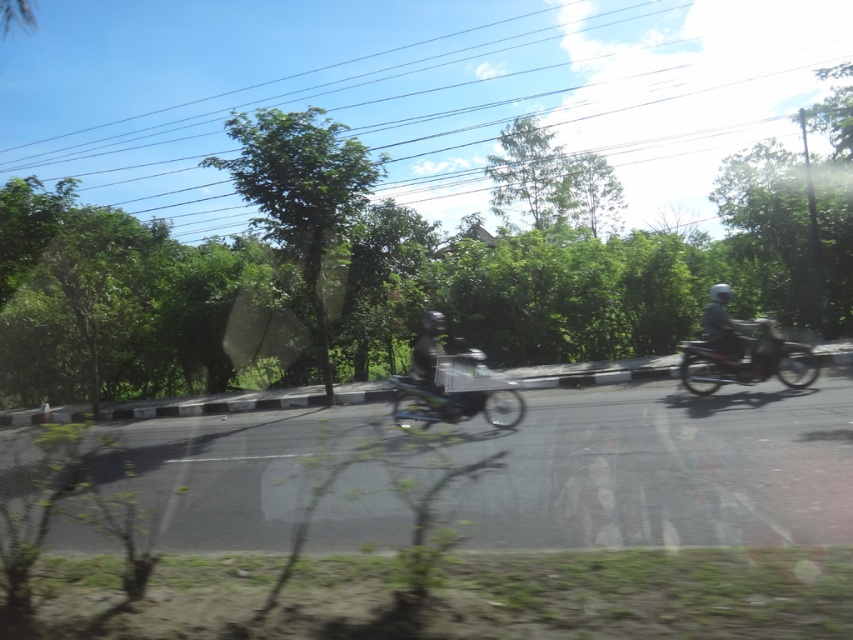
Question: Observing the image, what is the correct spatial positioning of metallic silver motorcycle at right in reference to metallic silver bicycle at center?

Choices:
 (A) right
 (B) left

Answer: (A)

Question: Among these points, which one is nearest to the camera?

Choices:
 (A) (428, 406)
 (B) (759, 332)

Answer: (A)

Question: Which point is closer to the camera?

Choices:
 (A) (749, 371)
 (B) (503, 394)

Answer: (B)

Question: Which point is closer to the camera?

Choices:
 (A) metallic silver motorcycle at right
 (B) metallic silver bicycle at center

Answer: (B)

Question: Is metallic silver motorcycle at right positioned at the back of metallic silver bicycle at center?

Choices:
 (A) yes
 (B) no

Answer: (A)

Question: Can you confirm if metallic silver motorcycle at right is positioned to the right of metallic silver bicycle at center?

Choices:
 (A) no
 (B) yes

Answer: (B)